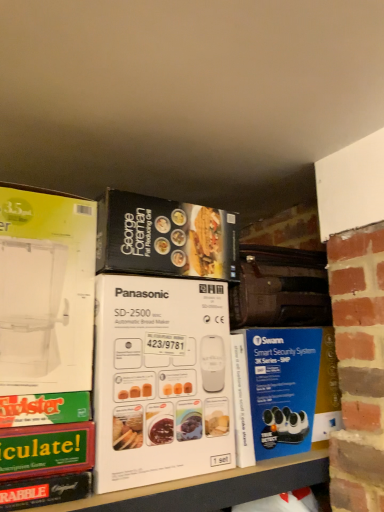
Looking at this image, measure the distance between point (30, 190) and camera.

33.11 inches.

The height and width of the screenshot is (512, 384). What do you see at coordinates (46, 290) in the screenshot?
I see `white plastic blender at left` at bounding box center [46, 290].

The image size is (384, 512). In order to click on white plastic blender at left in this screenshot , I will do `click(46, 290)`.

Locate an element on the screen. white plastic blender at left is located at coordinates (46, 290).